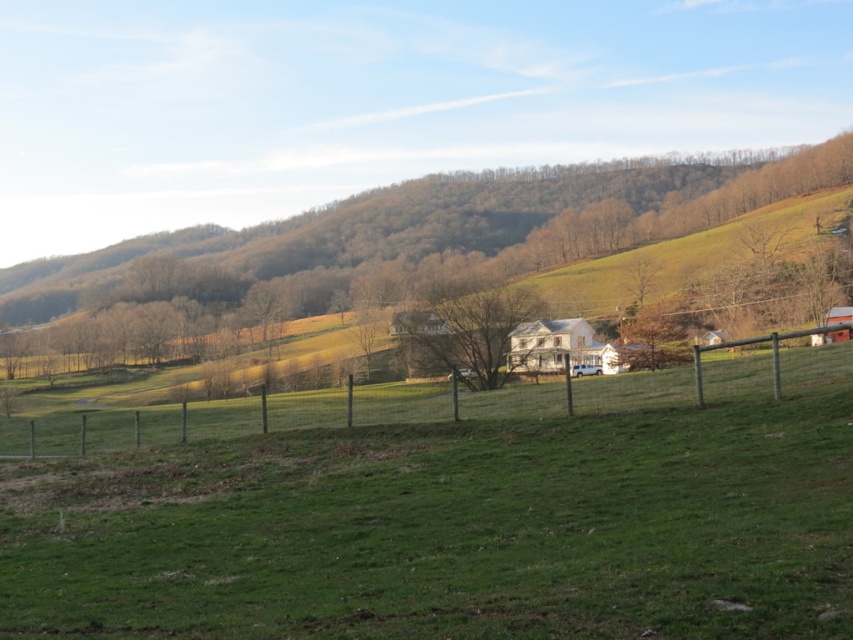
Between green grassy field at center and green leafy tree at center, which one has less height?

green grassy field at center is shorter.

Who is lower down, green grassy field at center or green leafy tree at center?

Positioned lower is green grassy field at center.

The width and height of the screenshot is (853, 640). Find the location of `green grassy field at center`. green grassy field at center is located at coordinates (454, 529).

Between green leafy tree at center and bare branches at center, which one is positioned lower?

Positioned lower is bare branches at center.

Describe the element at coordinates (518, 212) in the screenshot. The height and width of the screenshot is (640, 853). I see `green leafy tree at center` at that location.

Find the location of `green leafy tree at center`. green leafy tree at center is located at coordinates (518, 212).

Between green grassy field at center and bare branches at center, which one appears on the left side from the viewer's perspective?

green grassy field at center

Does green grassy field at center appear under bare branches at center?

Indeed, green grassy field at center is positioned under bare branches at center.

Is point (242, 512) positioned before point (502, 328)?

Yes, point (242, 512) is in front of point (502, 328).

You are a GUI agent. You are given a task and a screenshot of the screen. Output one action in this format:
    pyautogui.click(x=<x>, y=<y>)
    Task: Click on the green grassy field at center
    The height and width of the screenshot is (640, 853).
    Given the screenshot: What is the action you would take?
    pyautogui.click(x=454, y=529)